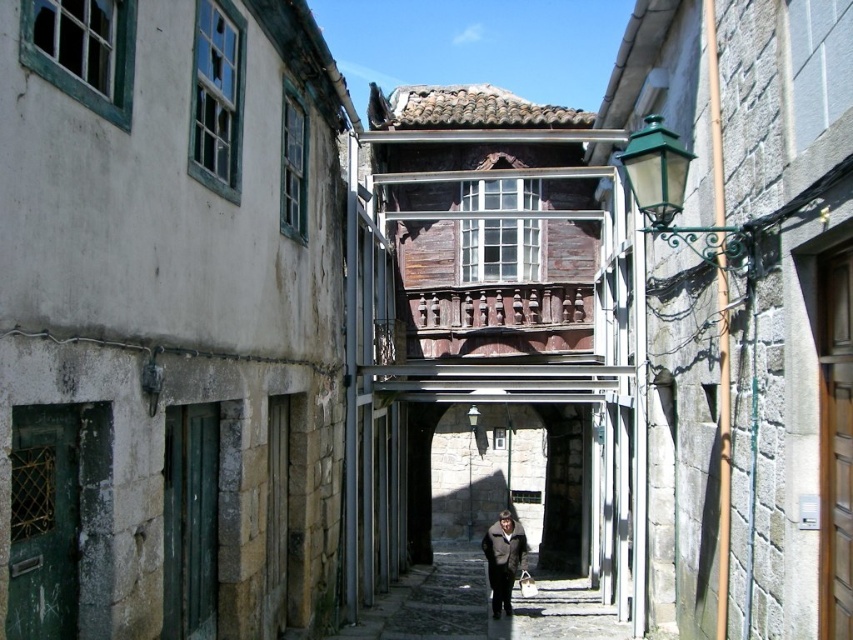
Question: Does smooth stone path at center come behind dark brown leather coat at center?

Choices:
 (A) no
 (B) yes

Answer: (A)

Question: Is smooth stone path at center closer to camera compared to dark brown leather coat at center?

Choices:
 (A) yes
 (B) no

Answer: (A)

Question: Among these points, which one is farthest from the camera?

Choices:
 (A) (523, 534)
 (B) (422, 611)

Answer: (A)

Question: Which object appears farthest from the camera in this image?

Choices:
 (A) smooth stone path at center
 (B) dark brown leather coat at center

Answer: (B)

Question: Which object appears farthest from the camera in this image?

Choices:
 (A) smooth stone path at center
 (B) dark brown leather coat at center

Answer: (B)

Question: Is smooth stone path at center to the right of dark brown leather coat at center from the viewer's perspective?

Choices:
 (A) yes
 (B) no

Answer: (B)